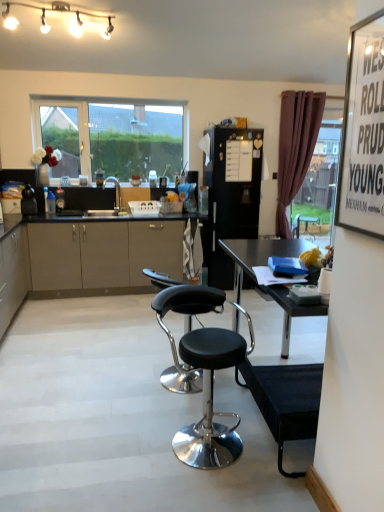
Question: Is point click(228, 146) closer or farther from the camera than point click(276, 433)?

Choices:
 (A) farther
 (B) closer

Answer: (A)

Question: From their relative heights in the image, would you say black matte refrigerator at center, the first appliance when ordered from right to left, is taller or shorter than black plastic table at center?

Choices:
 (A) short
 (B) tall

Answer: (B)

Question: Estimate the real-world distances between objects in this image. Which object is closer to the clear glass window at upper center?

Choices:
 (A) white glossy string lights at upper center
 (B) black leather stool at center, the 2th chair viewed from the back
 (C) plastic basket at center
 (D) black leather stool at center, the 2th chair viewed from the front
 (E) black plastic table at center

Answer: (C)

Question: Which object is positioned closest to the plastic basket at center?

Choices:
 (A) purple velvet curtain at right
 (B) matte beige cabinet at lower left
 (C) black matte refrigerator at center, which appears as the first appliance when viewed from the back
 (D) clear glass window at upper center
 (E) white paperboard at upper right

Answer: (D)